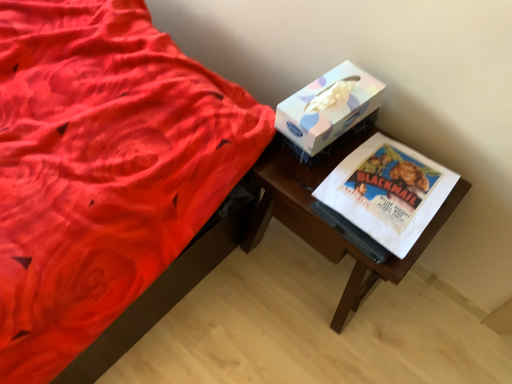
Describe the element at coordinates (328, 108) in the screenshot. I see `pastel paper tissue box at upper right` at that location.

Find the location of a particular element. Image resolution: width=512 pixels, height=384 pixels. white paper at right is located at coordinates pos(387,191).

I want to click on wooden table at right, so click(327, 224).

Is wooden table at right directly adjacent to white paper at right?

No, wooden table at right is not touching white paper at right.

Between point (339, 312) and point (387, 232), which one is positioned behind?

The point (339, 312) is farther.

In terms of height, does wooden table at right look taller or shorter compared to white paper at right?

Considering their sizes, wooden table at right has more height than white paper at right.

Can you confirm if wooden table at right is thinner than pastel paper tissue box at upper right?

In fact, wooden table at right might be wider than pastel paper tissue box at upper right.

Is pastel paper tissue box at upper right at the back of wooden table at right?

No, wooden table at right is not facing away from pastel paper tissue box at upper right.

Identify the location of box above the wooden table at right (from a real-world perspective). Image resolution: width=512 pixels, height=384 pixels. (328, 108).

From the image's perspective, between wooden table at right and pastel paper tissue box at upper right, which one is located above?

pastel paper tissue box at upper right appears higher in the image.

Considering their positions, is white paper at right located in front of or behind wooden table at right?

In the image, white paper at right appears in front of wooden table at right.

From the image's perspective, is white paper at right located above or below wooden table at right?

white paper at right is situated higher than wooden table at right in the image.

From their relative heights in the image, would you say white paper at right is taller or shorter than wooden table at right?

white paper at right is shorter than wooden table at right.

Which of these two, white paper at right or wooden table at right, is smaller?

white paper at right is smaller.

Where is `paperback book that appears below the pastel paper tissue box at upper right (from the image's perspective)`? paperback book that appears below the pastel paper tissue box at upper right (from the image's perspective) is located at coordinates (387, 191).

Considering the sizes of objects white paper at right and pastel paper tissue box at upper right in the image provided, who is bigger, white paper at right or pastel paper tissue box at upper right?

With larger size is pastel paper tissue box at upper right.

Between white paper at right and pastel paper tissue box at upper right, which one has less height?

white paper at right.

From the image's perspective, would you say pastel paper tissue box at upper right is positioned over white paper at right?

Correct, pastel paper tissue box at upper right appears higher than white paper at right in the image.

Where is `paperback book below the pastel paper tissue box at upper right (from a real-world perspective)`? Image resolution: width=512 pixels, height=384 pixels. paperback book below the pastel paper tissue box at upper right (from a real-world perspective) is located at coordinates (387, 191).

Which point is more distant from viewer, (322, 92) or (383, 135)?

The point (383, 135) is more distant.

From a real-world perspective, is pastel paper tissue box at upper right above or below white paper at right?

pastel paper tissue box at upper right is situated higher than white paper at right in the real world.

Is wooden table at right a part of pastel paper tissue box at upper right?

Actually, wooden table at right is outside pastel paper tissue box at upper right.

Considering the sizes of pastel paper tissue box at upper right and wooden table at right in the image, is pastel paper tissue box at upper right taller or shorter than wooden table at right?

In the image, pastel paper tissue box at upper right appears to be shorter than wooden table at right.

From a real-world perspective, is pastel paper tissue box at upper right below wooden table at right?

No, from a real-world perspective, pastel paper tissue box at upper right is not beneath wooden table at right.

You are a GUI agent. You are given a task and a screenshot of the screen. Output one action in this format:
    pyautogui.click(x=<x>, y=<y>)
    Task: Click on the table directly beneath the white paper at right (from a real-world perspective)
    The image size is (512, 384).
    Given the screenshot: What is the action you would take?
    pyautogui.click(x=327, y=224)

Image resolution: width=512 pixels, height=384 pixels. What are the coordinates of `box that appears above the wooden table at right (from the image's perspective)` in the screenshot? It's located at (328, 108).

From the image, which object appears to be farther from pastel paper tissue box at upper right, white paper at right or wooden table at right?

Among the two, wooden table at right is located further to pastel paper tissue box at upper right.

Looking at the image, which one is located further to white paper at right, wooden table at right or pastel paper tissue box at upper right?

Based on the image, pastel paper tissue box at upper right appears to be further to white paper at right.

Based on their spatial positions, is wooden table at right or white paper at right further from pastel paper tissue box at upper right?

wooden table at right is further to pastel paper tissue box at upper right.

From the image, which object appears to be nearer to wooden table at right, white paper at right or pastel paper tissue box at upper right?

Among the two, white paper at right is located nearer to wooden table at right.

Based on their spatial positions, is pastel paper tissue box at upper right or wooden table at right closer to white paper at right?

wooden table at right is closer to white paper at right.

Considering their positions, is pastel paper tissue box at upper right positioned further to wooden table at right than white paper at right?

pastel paper tissue box at upper right is positioned further to the anchor wooden table at right.

Find the location of `paperback book that lies between pastel paper tissue box at upper right and wooden table at right from top to bottom`. paperback book that lies between pastel paper tissue box at upper right and wooden table at right from top to bottom is located at coordinates (387, 191).